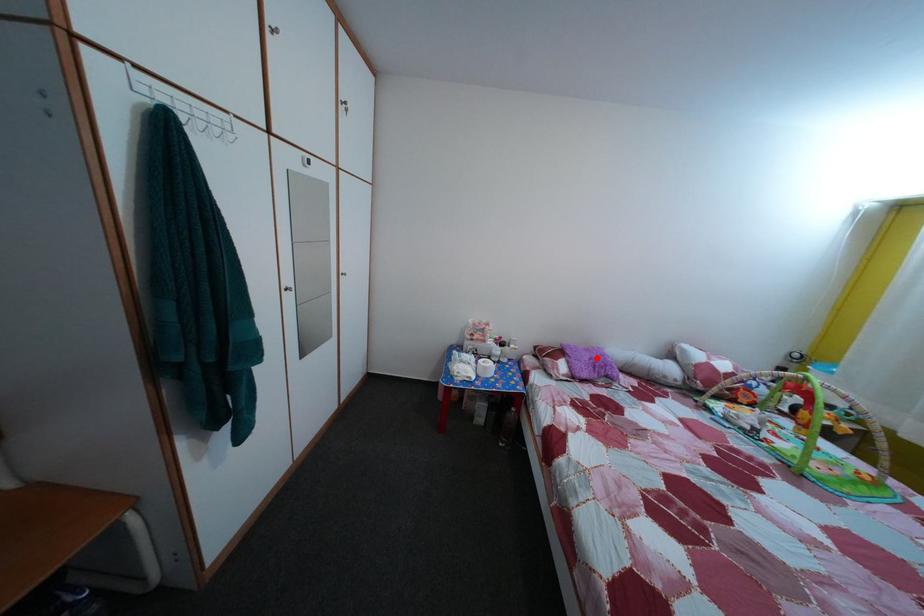
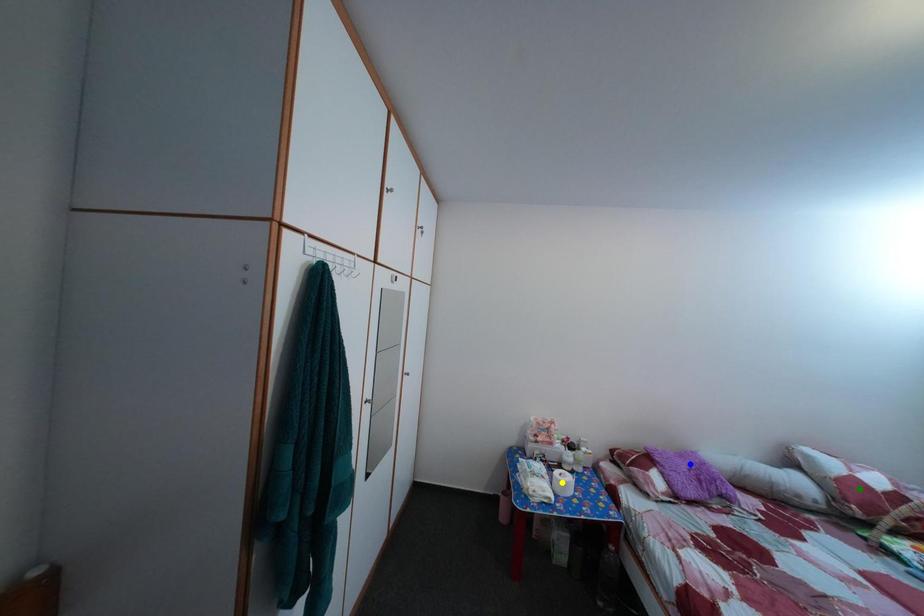
Question: I am providing you with two images of the same scene from different viewpoints. A red point is marked on the first image. You are given multiple points on the second image. Which point in image 2 is actually the same real-world point as the red point in image 1?

Choices:
 (A) yellow point
 (B) green point
 (C) blue point

Answer: (C)